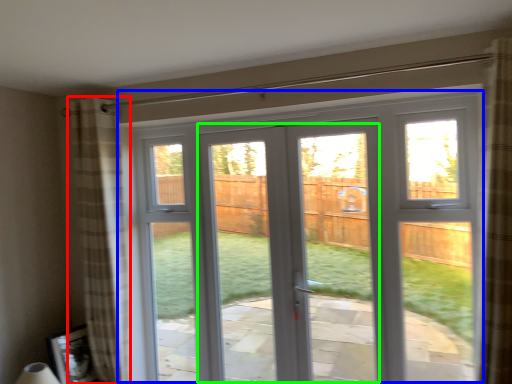
Question: Considering the real-world distances, which object is closest to curtain (highlighted by a red box)? window (highlighted by a blue box) or screen door (highlighted by a green box).

Choices:
 (A) window
 (B) screen door

Answer: (A)